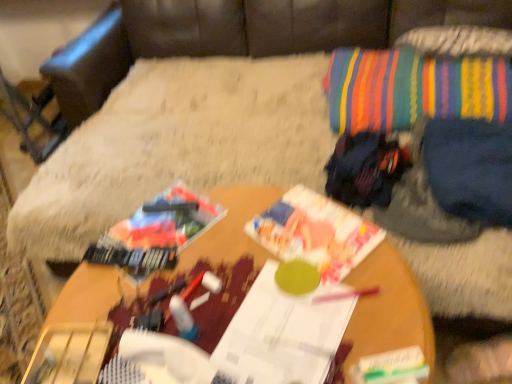
You are a GUI agent. You are given a task and a screenshot of the screen. Output one action in this format:
    pyautogui.click(x=<x>, y=<y>)
    Task: Click on the free space above white paper magazine at center, positioned as the 1th magazine in bottom-to-top order (from a real-world perspective)
    This screenshot has height=384, width=512.
    Given the screenshot: What is the action you would take?
    pyautogui.click(x=284, y=328)